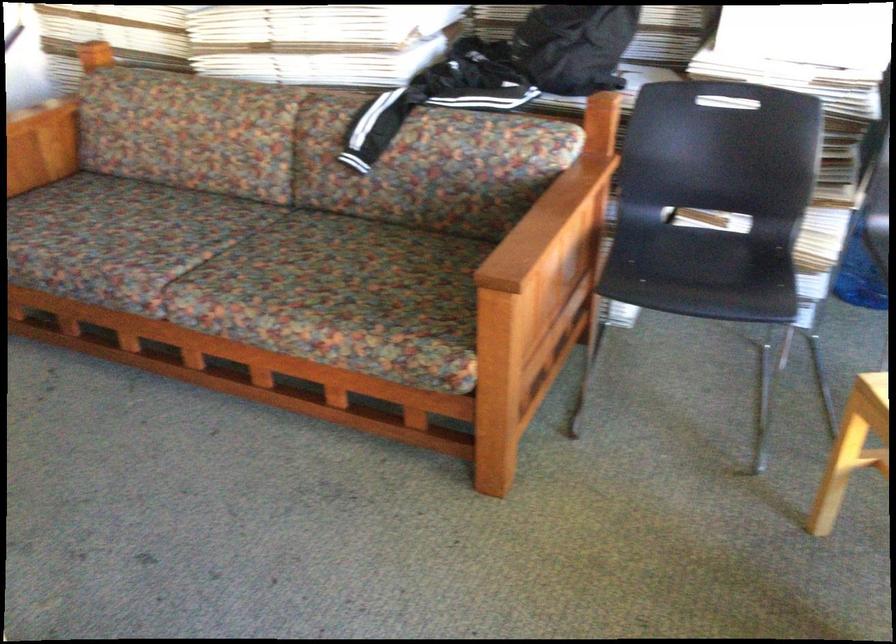
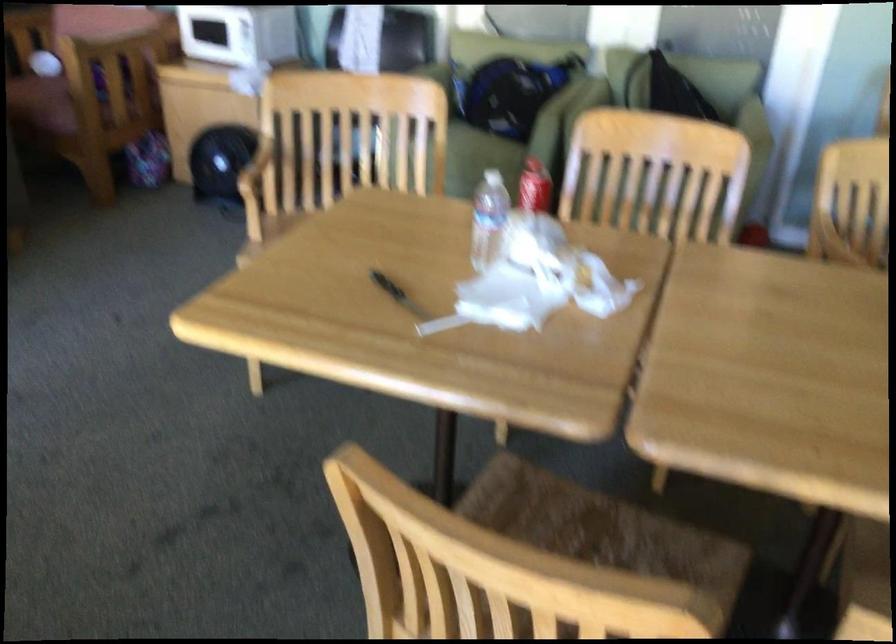
Based on the continuous images, in which direction is the camera rotating?

The camera's rotation is toward left-down.